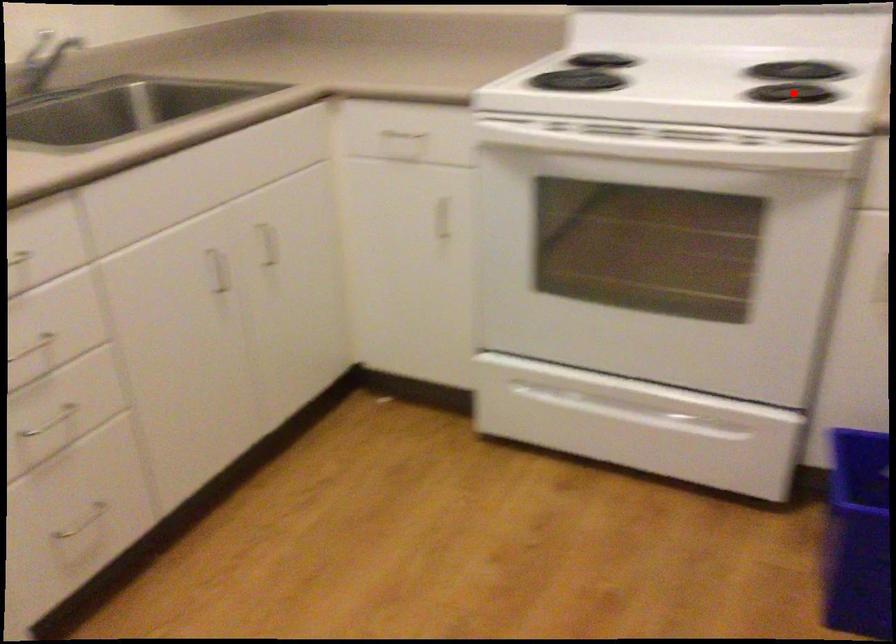
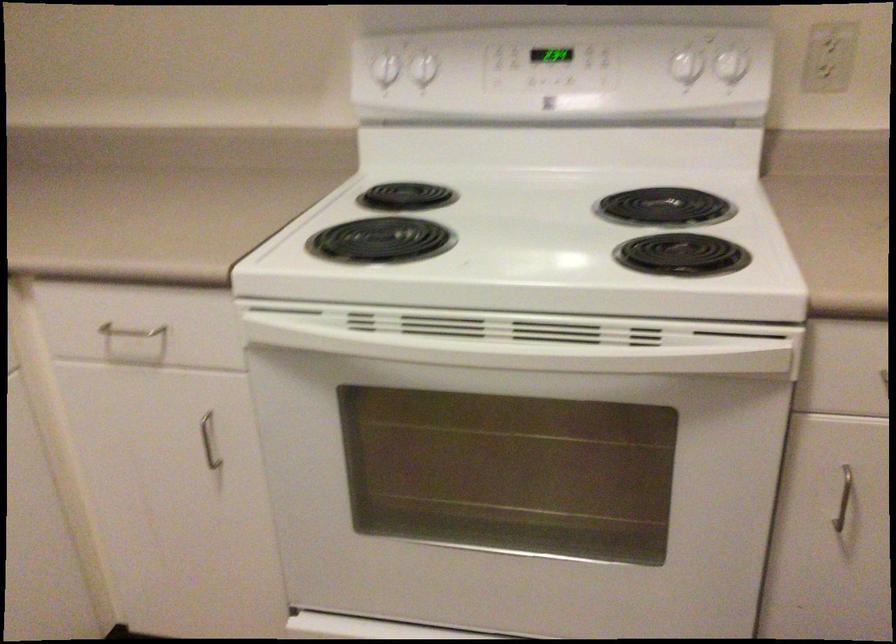
Locate, in the second image, the point that corresponds to the highlighted location in the first image.

(682, 254)